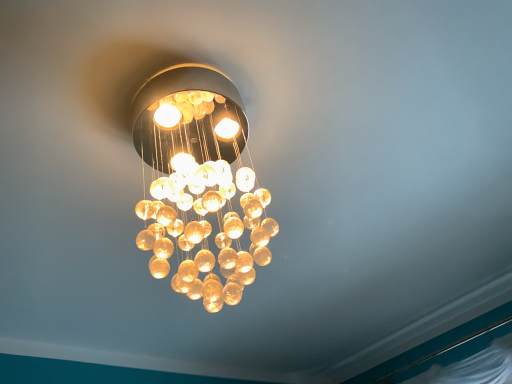
The width and height of the screenshot is (512, 384). I want to click on translucent amber glass at center, so click(199, 182).

Describe the element at coordinates (199, 182) in the screenshot. I see `translucent amber glass at center` at that location.

Measure the distance between point [199,93] and camera.

They are 33.62 inches apart.

Image resolution: width=512 pixels, height=384 pixels. Identify the location of translucent amber glass at center. (x=199, y=182).